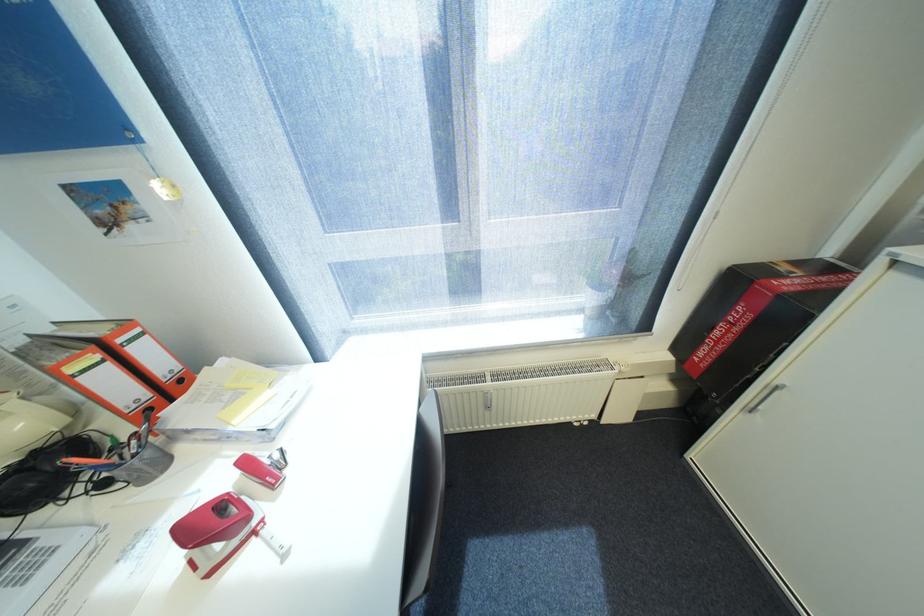
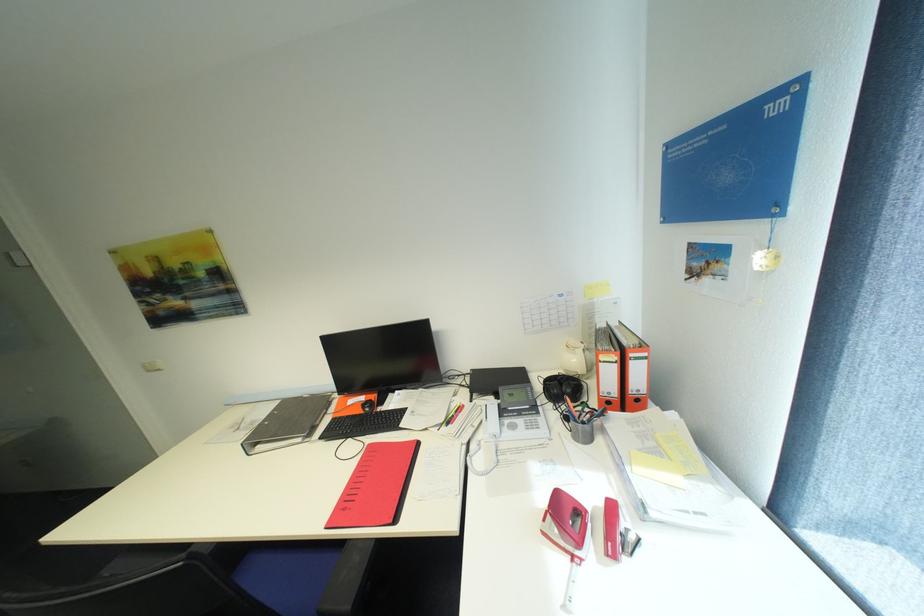
Based on the continuous images, in which direction is the camera rotating?

The camera rotated toward left-down.